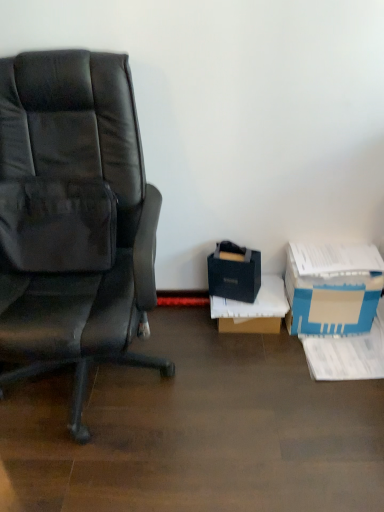
You are a GUI agent. You are given a task and a screenshot of the screen. Output one action in this format:
    pyautogui.click(x=<x>, y=<y>)
    Task: Click on the black matte bag at lower right, the 3th box in the right-to-left sequence
    The height and width of the screenshot is (512, 384).
    Given the screenshot: What is the action you would take?
    pyautogui.click(x=234, y=273)

Image resolution: width=384 pixels, height=512 pixels. I want to click on blue cardboard box at lower right, which is the 3th box in left-to-right order, so click(332, 288).

Locate an element on the screen. Image resolution: width=384 pixels, height=512 pixels. black matte box at lower right, acting as the 2th box starting from the right is located at coordinates (253, 309).

From the image's perspective, is blue cardboard box at lower right, the first box in the right-to-left sequence, under matte black chair at left?

Yes.

Is blue cardboard box at lower right, the first box in the right-to-left sequence, in contact with matte black chair at left?

No.

Can you confirm if blue cardboard box at lower right, the first box in the right-to-left sequence, is bigger than matte black chair at left?

No.

I want to click on chair in front of the blue cardboard box at lower right, which is the 3th box in left-to-right order, so click(x=73, y=218).

Can you confirm if matte black chair at left is positioned to the left of black matte box at lower right, acting as the 2th box starting from the right?

Yes, matte black chair at left is to the left of black matte box at lower right, acting as the 2th box starting from the right.

Between matte black chair at left and black matte box at lower right, which is the 2th box from left to right, which one has larger width?

With larger width is matte black chair at left.

From a real-world perspective, relative to black matte box at lower right, acting as the 2th box starting from the right, is matte black chair at left vertically above or below?

matte black chair at left is situated higher than black matte box at lower right, acting as the 2th box starting from the right, in the real world.

Where is `chair that is above the black matte box at lower right, acting as the 2th box starting from the right (from the image's perspective)`? The height and width of the screenshot is (512, 384). chair that is above the black matte box at lower right, acting as the 2th box starting from the right (from the image's perspective) is located at coordinates [x=73, y=218].

Considering the points (230, 315) and (65, 59), which point is in front, point (230, 315) or point (65, 59)?

The point (65, 59) is closer to the camera.

Is black matte box at lower right, which is the 2th box from left to right, not close to matte black chair at left?

Actually, black matte box at lower right, which is the 2th box from left to right, and matte black chair at left are a little close together.

Considering the positions of objects black matte box at lower right, acting as the 2th box starting from the right, and matte black chair at left in the image provided, who is more to the left, black matte box at lower right, acting as the 2th box starting from the right, or matte black chair at left?

Positioned to the left is matte black chair at left.

I want to click on chair above the black matte box at lower right, which is the 2th box from left to right (from the image's perspective), so click(73, 218).

Can you confirm if matte black chair at left is positioned to the left of blue cardboard box at lower right, the first box in the right-to-left sequence?

Correct, you'll find matte black chair at left to the left of blue cardboard box at lower right, the first box in the right-to-left sequence.

Considering their positions, is matte black chair at left located in front of or behind blue cardboard box at lower right, the first box in the right-to-left sequence?

matte black chair at left is in front of blue cardboard box at lower right, the first box in the right-to-left sequence.

Can you confirm if matte black chair at left is smaller than blue cardboard box at lower right, the first box in the right-to-left sequence?

No.

From the image's perspective, between matte black chair at left and black matte bag at lower right, the 3th box in the right-to-left sequence, which one is located above?

From the image's view, matte black chair at left is above.

Which object is more forward, matte black chair at left or black matte bag at lower right, the 3th box in the right-to-left sequence?

Positioned in front is matte black chair at left.

Choose the correct answer: Is matte black chair at left inside black matte bag at lower right, placed as the 1th box when sorted from left to right, or outside it?

matte black chair at left is spatially situated outside black matte bag at lower right, placed as the 1th box when sorted from left to right.

From their relative heights in the image, would you say matte black chair at left is taller or shorter than black matte bag at lower right, the 3th box in the right-to-left sequence?

matte black chair at left is taller than black matte bag at lower right, the 3th box in the right-to-left sequence.

Is blue cardboard box at lower right, the first box in the right-to-left sequence, in contact with black matte bag at lower right, the 3th box in the right-to-left sequence?

No, blue cardboard box at lower right, the first box in the right-to-left sequence, is not next to black matte bag at lower right, the 3th box in the right-to-left sequence.

Considering the relative positions of blue cardboard box at lower right, which is the 3th box in left-to-right order, and black matte bag at lower right, placed as the 1th box when sorted from left to right, in the image provided, is blue cardboard box at lower right, which is the 3th box in left-to-right order, behind black matte bag at lower right, placed as the 1th box when sorted from left to right,?

No, the depth of blue cardboard box at lower right, which is the 3th box in left-to-right order, is less than that of black matte bag at lower right, placed as the 1th box when sorted from left to right.

Would you say blue cardboard box at lower right, the first box in the right-to-left sequence, is outside black matte bag at lower right, placed as the 1th box when sorted from left to right?

Yes, blue cardboard box at lower right, the first box in the right-to-left sequence, is not within black matte bag at lower right, placed as the 1th box when sorted from left to right.

Considering the sizes of objects blue cardboard box at lower right, the first box in the right-to-left sequence, and black matte bag at lower right, the 3th box in the right-to-left sequence, in the image provided, who is thinner, blue cardboard box at lower right, the first box in the right-to-left sequence, or black matte bag at lower right, the 3th box in the right-to-left sequence,?

black matte bag at lower right, the 3th box in the right-to-left sequence.

Is black matte bag at lower right, placed as the 1th box when sorted from left to right, situated inside matte black chair at left or outside?

black matte bag at lower right, placed as the 1th box when sorted from left to right, cannot be found inside matte black chair at left.

Can you confirm if black matte bag at lower right, the 3th box in the right-to-left sequence, is positioned to the left of matte black chair at left?

In fact, black matte bag at lower right, the 3th box in the right-to-left sequence, is to the right of matte black chair at left.

Is black matte bag at lower right, the 3th box in the right-to-left sequence, smaller than matte black chair at left?

Correct, black matte bag at lower right, the 3th box in the right-to-left sequence, occupies less space than matte black chair at left.

Considering their positions, is black matte bag at lower right, the 3th box in the right-to-left sequence, located in front of or behind matte black chair at left?

Clearly, black matte bag at lower right, the 3th box in the right-to-left sequence, is behind matte black chair at left.

Locate an element on the screen. The image size is (384, 512). chair on the left of blue cardboard box at lower right, which is the 3th box in left-to-right order is located at coordinates (73, 218).

I want to click on chair above the black matte box at lower right, which is the 2th box from left to right (from a real-world perspective), so click(x=73, y=218).

From the image, which object appears to be farther from black matte bag at lower right, placed as the 1th box when sorted from left to right, blue cardboard box at lower right, the first box in the right-to-left sequence, or black matte box at lower right, acting as the 2th box starting from the right?

blue cardboard box at lower right, the first box in the right-to-left sequence.

Considering their positions, is black matte box at lower right, which is the 2th box from left to right, positioned closer to black matte bag at lower right, the 3th box in the right-to-left sequence, than matte black chair at left?

black matte box at lower right, which is the 2th box from left to right, is closer to black matte bag at lower right, the 3th box in the right-to-left sequence.

In the scene shown: Looking at the image, which one is located further to black matte box at lower right, which is the 2th box from left to right, matte black chair at left or black matte bag at lower right, placed as the 1th box when sorted from left to right?

The object further to black matte box at lower right, which is the 2th box from left to right, is matte black chair at left.

When comparing their distances from matte black chair at left, does black matte bag at lower right, the 3th box in the right-to-left sequence, or blue cardboard box at lower right, which is the 3th box in left-to-right order, seem further?

Based on the image, blue cardboard box at lower right, which is the 3th box in left-to-right order, appears to be further to matte black chair at left.

Based on their spatial positions, is blue cardboard box at lower right, the first box in the right-to-left sequence, or matte black chair at left further from black matte bag at lower right, the 3th box in the right-to-left sequence?

matte black chair at left is further to black matte bag at lower right, the 3th box in the right-to-left sequence.

When comparing their distances from matte black chair at left, does black matte box at lower right, acting as the 2th box starting from the right, or blue cardboard box at lower right, the first box in the right-to-left sequence, seem closer?

black matte box at lower right, acting as the 2th box starting from the right, is closer to matte black chair at left.

When comparing their distances from blue cardboard box at lower right, which is the 3th box in left-to-right order, does black matte bag at lower right, placed as the 1th box when sorted from left to right, or black matte box at lower right, which is the 2th box from left to right, seem further?

black matte bag at lower right, placed as the 1th box when sorted from left to right, is positioned further to the anchor blue cardboard box at lower right, which is the 3th box in left-to-right order.

From the image, which object appears to be nearer to blue cardboard box at lower right, which is the 3th box in left-to-right order, black matte bag at lower right, placed as the 1th box when sorted from left to right, or matte black chair at left?

Based on the image, black matte bag at lower right, placed as the 1th box when sorted from left to right, appears to be nearer to blue cardboard box at lower right, which is the 3th box in left-to-right order.

Image resolution: width=384 pixels, height=512 pixels. In order to click on box located between black matte bag at lower right, placed as the 1th box when sorted from left to right, and blue cardboard box at lower right, the first box in the right-to-left sequence, in the left-right direction in this screenshot , I will do `click(253, 309)`.